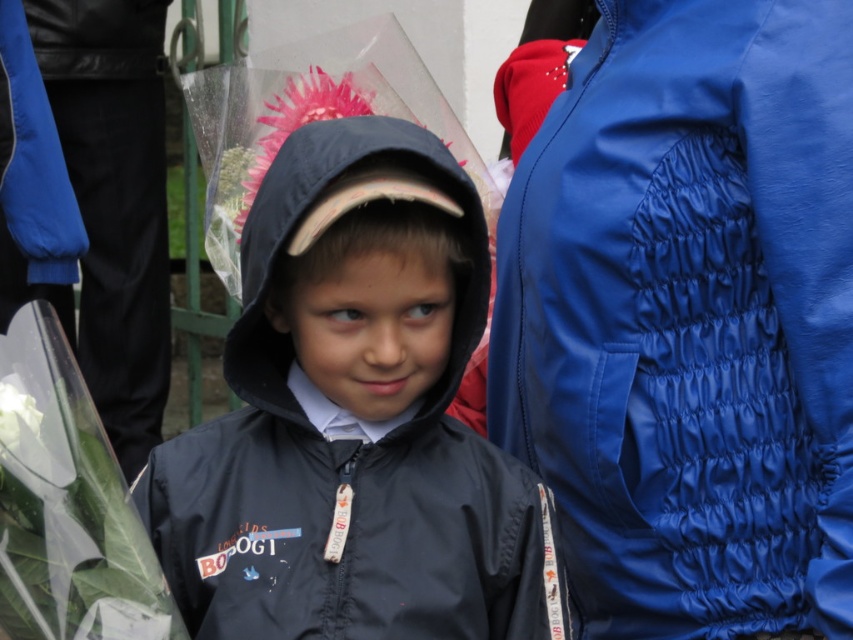
Question: Is blue quilted jacket at right smaller than matte black jacket at center?

Choices:
 (A) no
 (B) yes

Answer: (A)

Question: Can you confirm if matte black jacket at center is positioned above pink fabric flower at center?

Choices:
 (A) no
 (B) yes

Answer: (A)

Question: Is blue quilted jacket at right wider than pink fabric flower at center?

Choices:
 (A) yes
 (B) no

Answer: (A)

Question: Which of these objects is positioned closest to the matte black jacket at center?

Choices:
 (A) blue quilted jacket at right
 (B) pink fabric flower at center

Answer: (A)

Question: Which is farther from the matte black jacket at center?

Choices:
 (A) pink fabric flower at center
 (B) blue quilted jacket at right

Answer: (A)

Question: Considering the real-world distances, which object is closest to the blue quilted jacket at right?

Choices:
 (A) matte black jacket at center
 (B) pink fabric flower at center

Answer: (A)